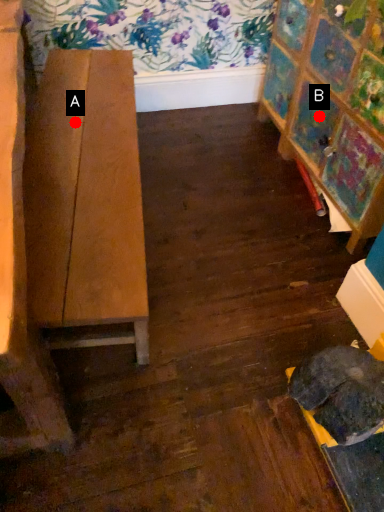
Question: Two points are circled on the image, labeled by A and B beside each circle. Which point is further to the camera?

Choices:
 (A) A is further
 (B) B is further

Answer: (B)